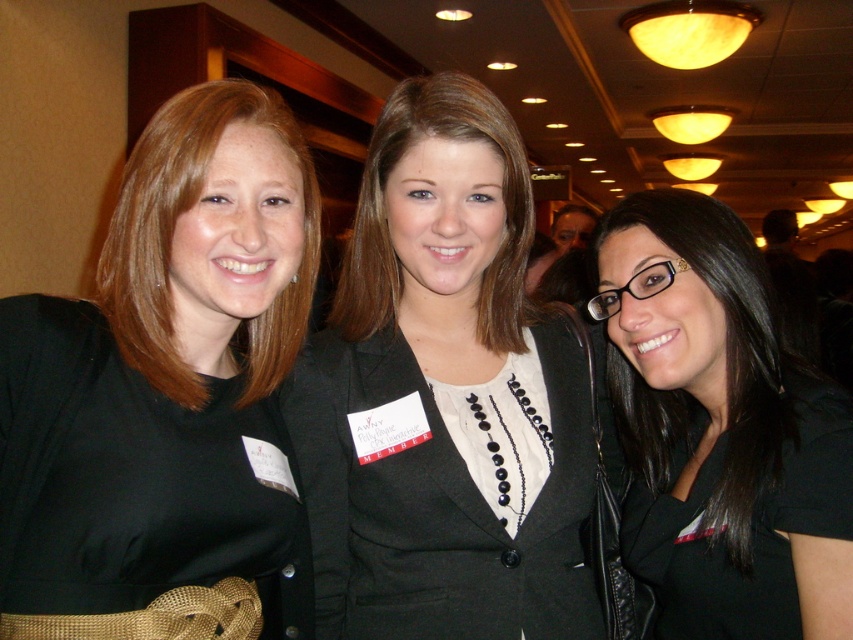
Question: Considering the relative positions of matte black dress at center and black matte blazer at center in the image provided, where is matte black dress at center located with respect to black matte blazer at center?

Choices:
 (A) above
 (B) below

Answer: (B)

Question: Does matte black dress at center appear on the left side of black matte blazer at center?

Choices:
 (A) yes
 (B) no

Answer: (A)

Question: Which of the following is the farthest from the observer?

Choices:
 (A) (167, 305)
 (B) (451, 577)
 (C) (810, 499)

Answer: (B)

Question: Does matte black dress at center appear under black matte blazer at center?

Choices:
 (A) no
 (B) yes

Answer: (B)

Question: Which point is closer to the camera taking this photo?

Choices:
 (A) (151, 467)
 (B) (718, 628)
 (C) (558, 596)

Answer: (A)

Question: Which of these objects is positioned farthest from the black matte/black textured hair at center?

Choices:
 (A) matte black dress at center
 (B) black matte blazer at center

Answer: (A)